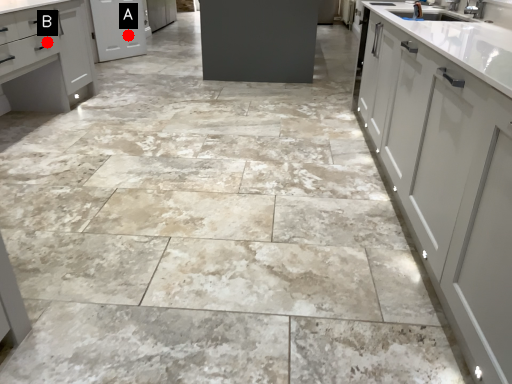
Question: Two points are circled on the image, labeled by A and B beside each circle. Which point is closer to the camera?

Choices:
 (A) A is closer
 (B) B is closer

Answer: (B)